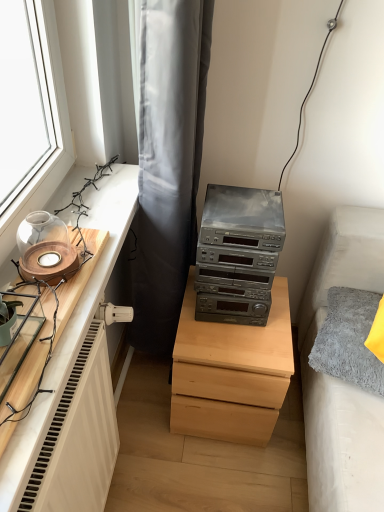
You are a GUI agent. You are given a task and a screenshot of the screen. Output one action in this format:
    pyautogui.click(x=<x>, y=<y>)
    Task: Click on the free space in front of metallic gray stereo at center
    
    Given the screenshot: What is the action you would take?
    (236, 340)